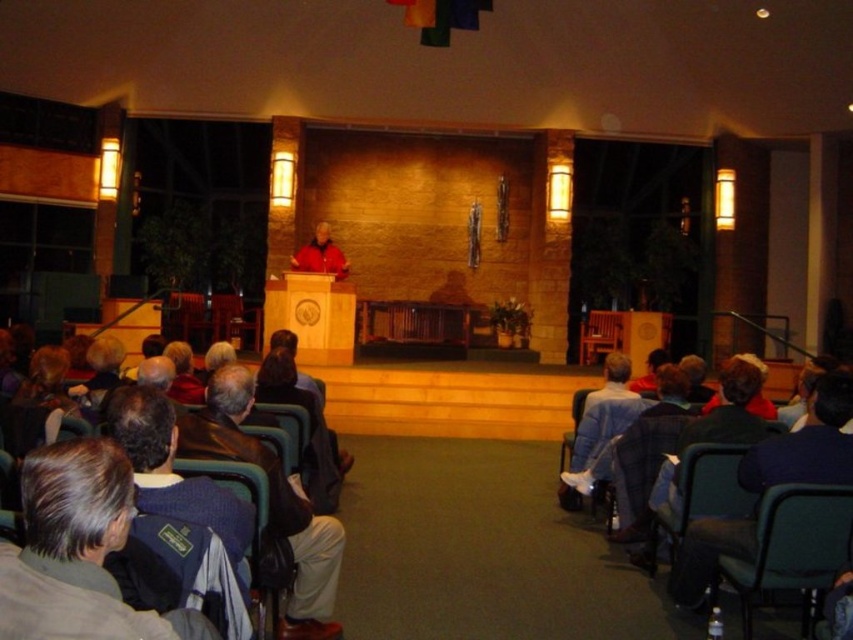
Question: Which is nearer to the dark gray jacket at lower left?

Choices:
 (A) dark blue fabric chairs at lower left
 (B) dark blue sweater at center
 (C) matte black chair at center

Answer: (A)

Question: Which of the following is the closest to the observer?

Choices:
 (A) dark blue fabric chairs at lower left
 (B) dark blue fabric chair at lower left
 (C) blue denim jacket at lower right

Answer: (B)

Question: Which object appears closest to the camera in this image?

Choices:
 (A) dark blue fabric chair at lower left
 (B) dark gray jacket at lower left

Answer: (B)

Question: Is dark blue sweater at lower right positioned in front of dark blue fabric chair at lower left?

Choices:
 (A) yes
 (B) no

Answer: (B)

Question: Does dark gray jacket at lower left appear on the right side of dark blue fabric chairs at lower left?

Choices:
 (A) yes
 (B) no

Answer: (B)

Question: Is dark gray jacket at lower left positioned behind wooden at center?

Choices:
 (A) yes
 (B) no

Answer: (B)